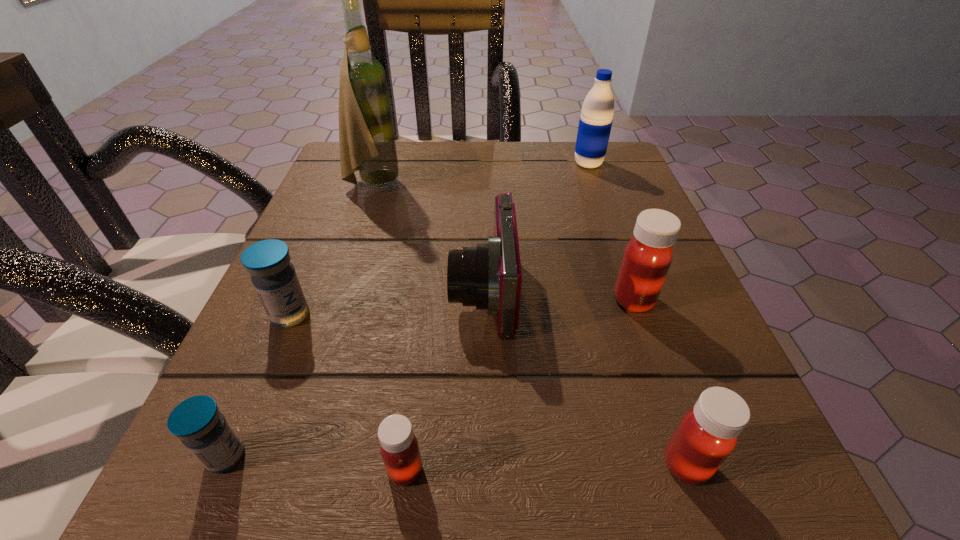
What are the coordinates of `vacant space situated on the back of the smaller blue medicine` in the screenshot? It's located at (301, 280).

At what (x,y) coordinates should I click in order to perform the action: click on wine bottle at the far edge. Please return your answer as a coordinate pair (x, y). Looking at the image, I should click on (367, 144).

Identify the location of water bottle that is positioned at the far edge. (595, 122).

Identify the location of wine bottle that is positioned at the left edge. (367, 144).

Locate an element on the screen. water bottle present at the right edge is located at coordinates (595, 122).

You are a GUI agent. You are given a task and a screenshot of the screen. Output one action in this format:
    pyautogui.click(x=<x>, y=<y>)
    Task: Click on the object present at the far left corner
    
    Given the screenshot: What is the action you would take?
    pyautogui.click(x=367, y=144)

The image size is (960, 540). I want to click on object located in the near left corner section of the desktop, so click(197, 422).

Identify the location of object positioned at the far right corner. Image resolution: width=960 pixels, height=540 pixels. (595, 122).

At what (x,y) coordinates should I click in order to perform the action: click on object located in the near right corner section of the desktop. Please return your answer as a coordinate pair (x, y). Image resolution: width=960 pixels, height=540 pixels. Looking at the image, I should click on (707, 434).

Image resolution: width=960 pixels, height=540 pixels. In the image, there is a desktop. Find the location of `vacant space at the far edge`. vacant space at the far edge is located at coordinates (444, 195).